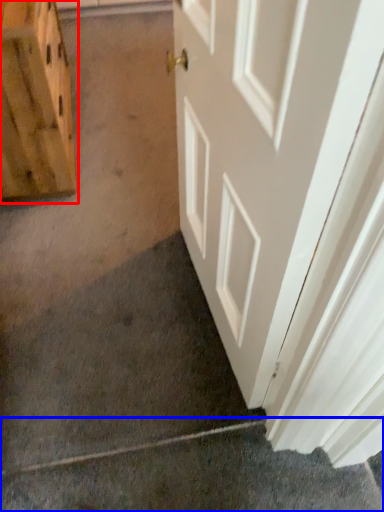
Question: Which object is closer to the camera taking this photo, cabinetry (highlighted by a red box) or concrete (highlighted by a blue box)?

Choices:
 (A) cabinetry
 (B) concrete

Answer: (B)